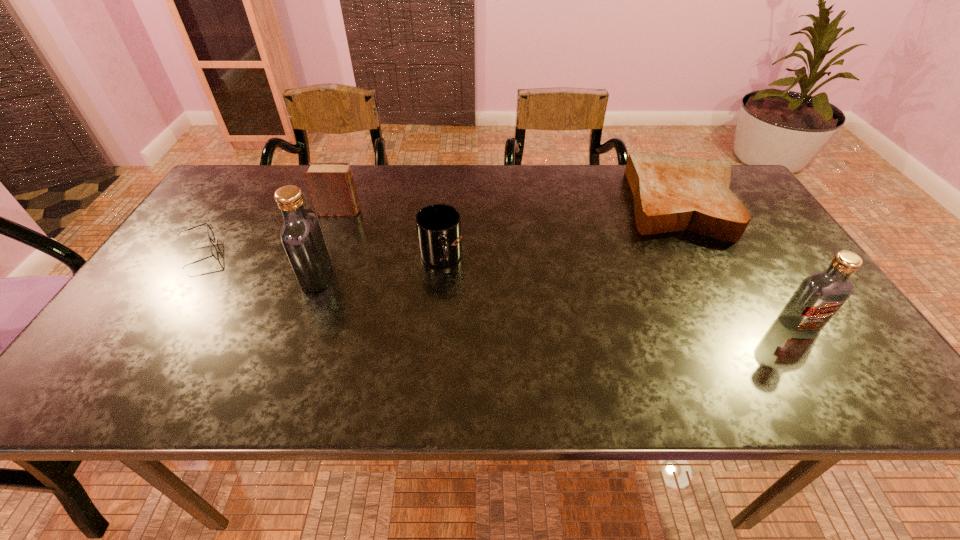
Find the location of `object at the left edge`. object at the left edge is located at coordinates (214, 252).

Identify the location of vodka positioned at the right edge. Image resolution: width=960 pixels, height=540 pixels. (820, 295).

Identify the location of bread positioned at the right edge. (671, 193).

Identify the location of object that is at the far right corner. The height and width of the screenshot is (540, 960). (671, 193).

The width and height of the screenshot is (960, 540). I want to click on object present at the near right corner, so coord(820,295).

Locate an element on the screen. free spot at the far edge of the desktop is located at coordinates pos(496,199).

Where is `vacant area at the near edge of the desktop`? Image resolution: width=960 pixels, height=540 pixels. vacant area at the near edge of the desktop is located at coordinates (688, 347).

Where is `vacant point at the left edge`? This screenshot has width=960, height=540. vacant point at the left edge is located at coordinates (181, 251).

The height and width of the screenshot is (540, 960). Find the location of `vacant area at the right edge`. vacant area at the right edge is located at coordinates (791, 276).

This screenshot has height=540, width=960. Identify the location of vacant space at the far left corner. tap(243, 176).